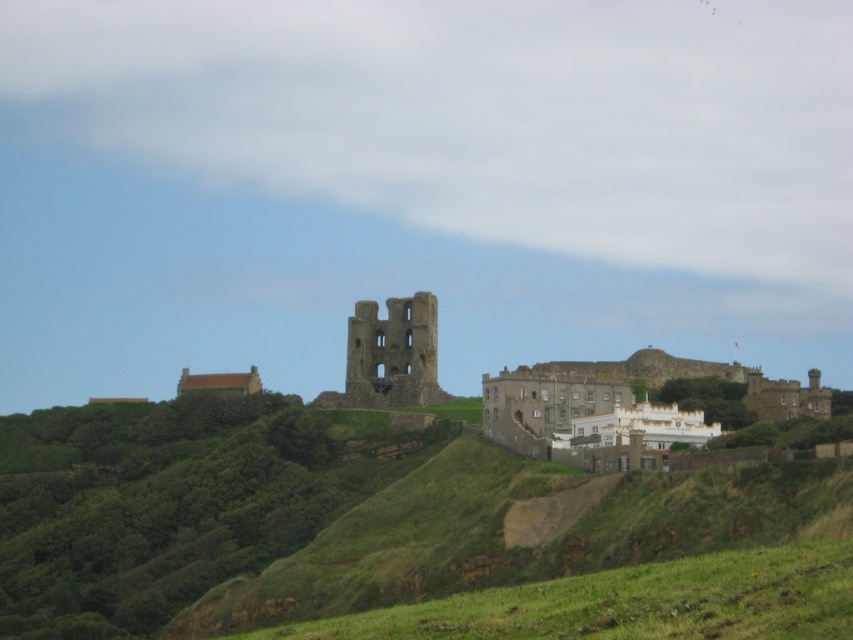
You are standing on the green grassy hillside at lower center and want to walk to the brown stone castle at center. Which direction should you move to get closer to the castle?

Since the green grassy hillside at lower center is closer to the viewer than the brown stone castle at center, you should move forward towards the castle, as it is located further away from your current position.

From the picture: You are standing at the point marked as point (328,515) in the image. Looking around, you see the green grassy hillside at center. What direction would you face to look towards the green grassy hillside at center?

Since you are standing at point (328,515) where the green grassy hillside at center is located, facing any direction would still have the hillside around you. However, if you want to look towards the center of the hillside, facing forward or backward might align with the slope direction depending on the terrain.

Consider the image. You are standing on the green grassy hillside at center and want to walk to the brown stone castle at center. Which direction should you walk to get closer to the castle?

Since the green grassy hillside at center is closer to the viewer than the brown stone castle at center, you should walk away from your current position towards the direction of the castle to get closer to it.